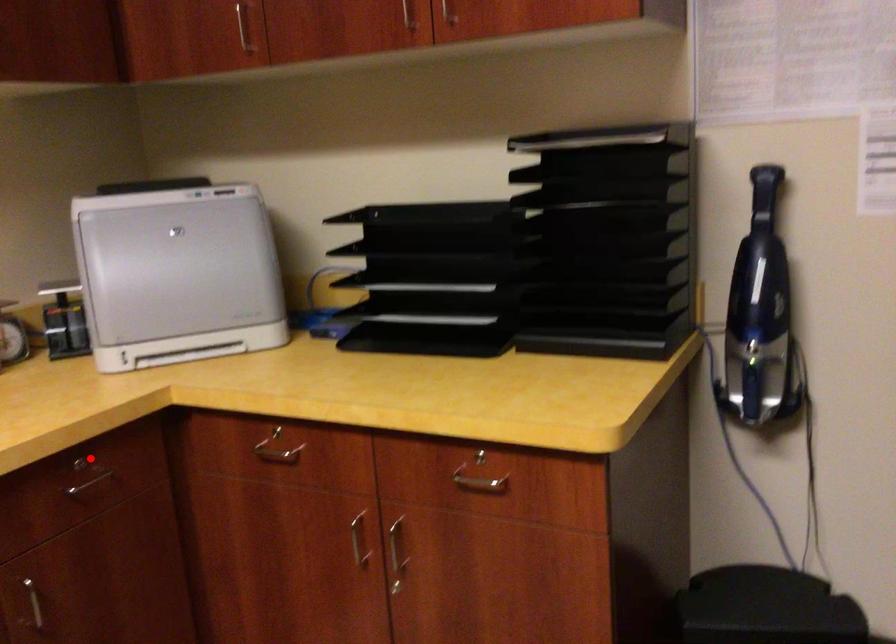
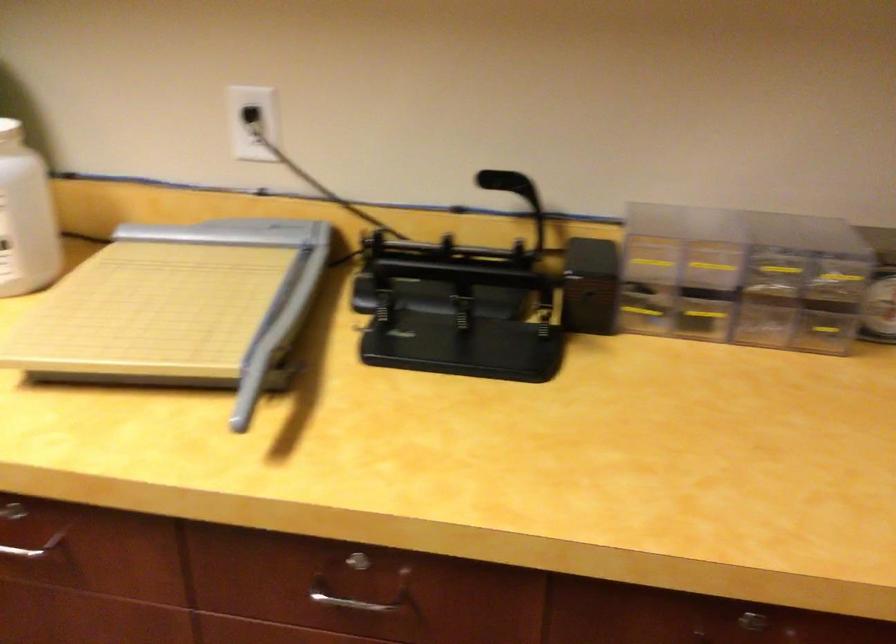
Question: I am providing you with two images of the same scene from different viewpoints. Image1 has a red point marked. In image2, the corresponding 3D location appears at what relative position? Reply with the corresponding letter.

Choices:
 (A) Closer
 (B) Farther

Answer: (A)